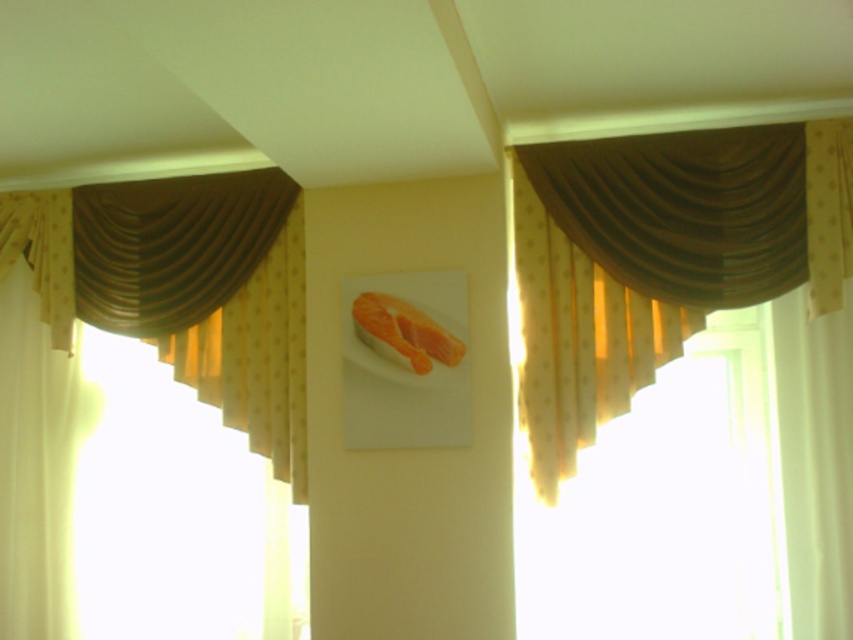
Question: Does brown sheer curtain at upper right have a greater width compared to brown satin curtain at upper left?

Choices:
 (A) no
 (B) yes

Answer: (A)

Question: Can you confirm if brown sheer curtain at upper right is thinner than brown satin curtain at upper left?

Choices:
 (A) no
 (B) yes

Answer: (B)

Question: Is brown sheer curtain at upper right further to camera compared to brown satin curtain at upper left?

Choices:
 (A) yes
 (B) no

Answer: (B)

Question: Which point is farther from the camera taking this photo?

Choices:
 (A) (733, 177)
 (B) (300, 385)

Answer: (B)

Question: Which object appears closest to the camera in this image?

Choices:
 (A) brown sheer curtain at upper right
 (B) brown satin curtain at upper left

Answer: (A)